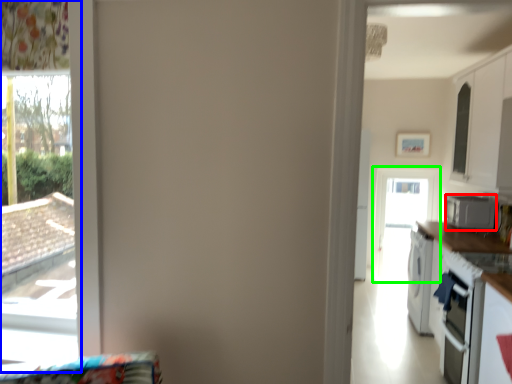
Question: Which object is positioned closest to appliance (highlighted by a red box)? Select from window (highlighted by a blue box) and screen door (highlighted by a green box).

Choices:
 (A) window
 (B) screen door

Answer: (B)